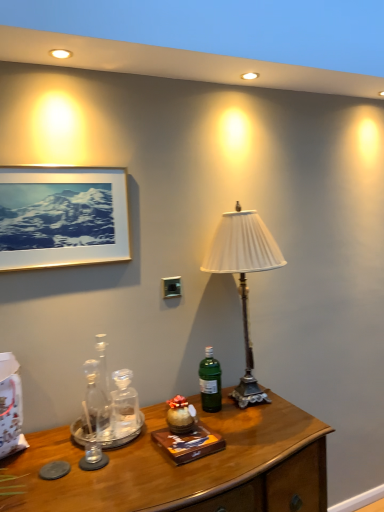
The image size is (384, 512). In order to click on blank space above wooden desk at lower center (from a real-world perspective) in this screenshot , I will do `click(165, 454)`.